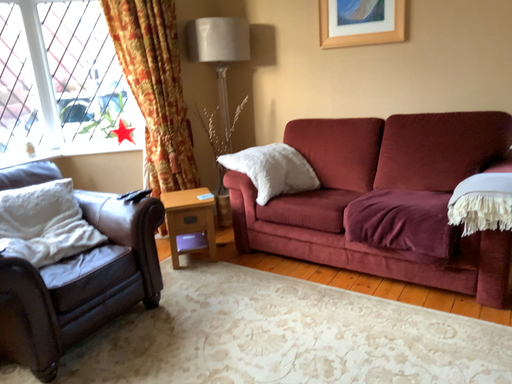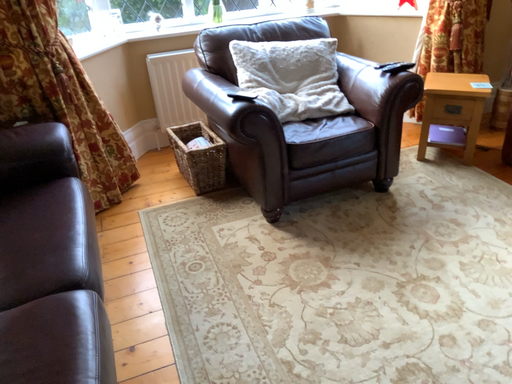
Question: How did the camera likely rotate when shooting the video?

Choices:
 (A) rotated left
 (B) rotated right

Answer: (A)